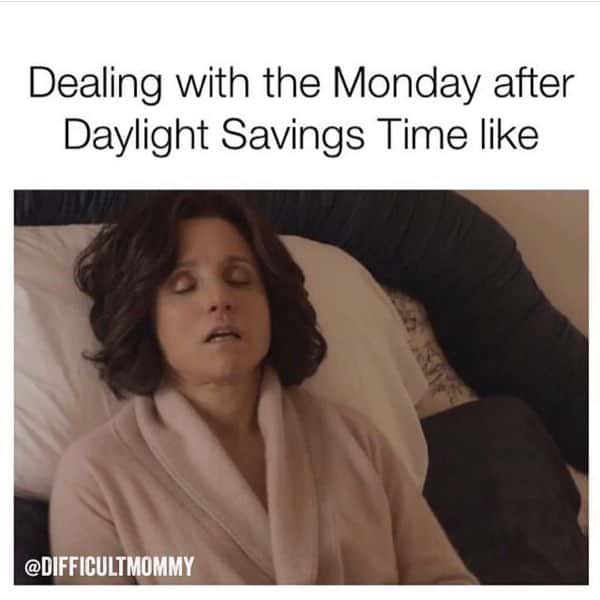
Locate an element on the screen. This screenshot has height=600, width=600. pillow is located at coordinates (88, 397).